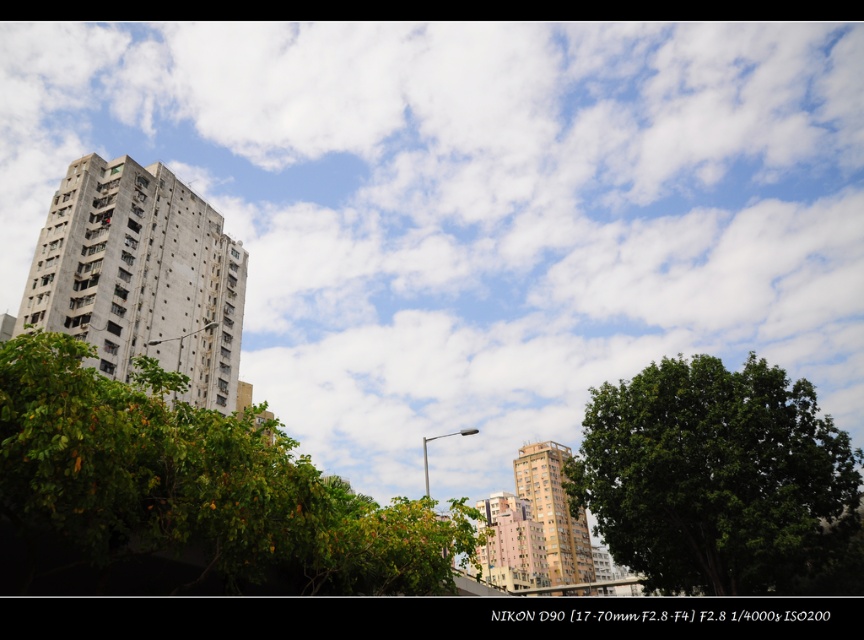
Question: Among these objects, which one is nearest to the camera?

Choices:
 (A) pink matte building at center
 (B) gray concrete building at left
 (C) green leafy tree at center
 (D) green leafy tree at lower left

Answer: (D)

Question: Which of the following is the farthest from the observer?

Choices:
 (A) pink matte building at center
 (B) green leafy tree at lower left

Answer: (A)

Question: Can you confirm if green leafy tree at center is wider than gray concrete building at left?

Choices:
 (A) yes
 (B) no

Answer: (B)

Question: Does green leafy tree at center have a lesser width compared to pink textured building at center?

Choices:
 (A) no
 (B) yes

Answer: (B)

Question: Which point appears farthest from the camera in this image?

Choices:
 (A) (221, 408)
 (B) (491, 493)
 (C) (423, 552)

Answer: (B)

Question: Is green leafy tree at center positioned in front of pink textured building at center?

Choices:
 (A) no
 (B) yes

Answer: (B)